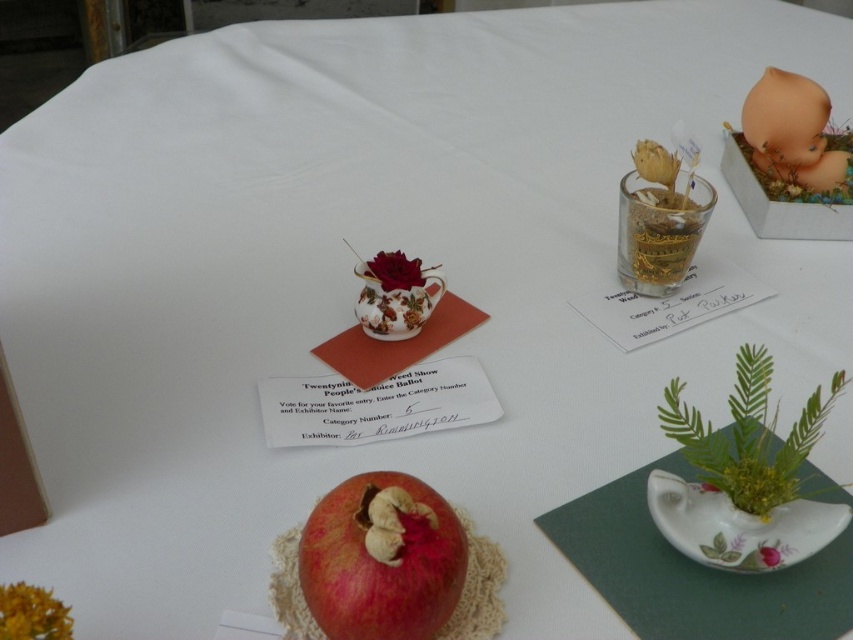
Is point (776, 168) positioned before point (763, 547)?

No, it is behind (763, 547).

Can you confirm if matte peach baby doll at upper right is thinner than matte ceramic flower at center right?

In fact, matte peach baby doll at upper right might be wider than matte ceramic flower at center right.

What do you see at coordinates (791, 131) in the screenshot?
I see `matte peach baby doll at upper right` at bounding box center [791, 131].

Find the location of a particular element. The width and height of the screenshot is (853, 640). matte peach baby doll at upper right is located at coordinates [x=791, y=131].

Who is positioned more to the left, floral-patterned ceramic teapot at center-left or matte floral cup at center?

Positioned to the left is matte floral cup at center.

In the scene shown: Between floral-patterned ceramic teapot at center-left and matte floral cup at center, which one appears on the right side from the viewer's perspective?

From the viewer's perspective, floral-patterned ceramic teapot at center-left appears more on the right side.

Is point (370, 285) more distant than point (380, 259)?

No, it is not.

Where is `floral-patterned ceramic teapot at center-left`? The height and width of the screenshot is (640, 853). floral-patterned ceramic teapot at center-left is located at coordinates (396, 296).

Does matte floral cup at center appear over matte ceramic flower at center right?

Correct, matte floral cup at center is located above matte ceramic flower at center right.

Does matte floral cup at center have a greater height compared to matte ceramic flower at center right?

Indeed, matte floral cup at center has a greater height compared to matte ceramic flower at center right.

Between point (392, 284) and point (764, 563), which one is positioned behind?

Positioned behind is point (392, 284).

Image resolution: width=853 pixels, height=640 pixels. Find the location of `matte floral cup at center`. matte floral cup at center is located at coordinates (393, 269).